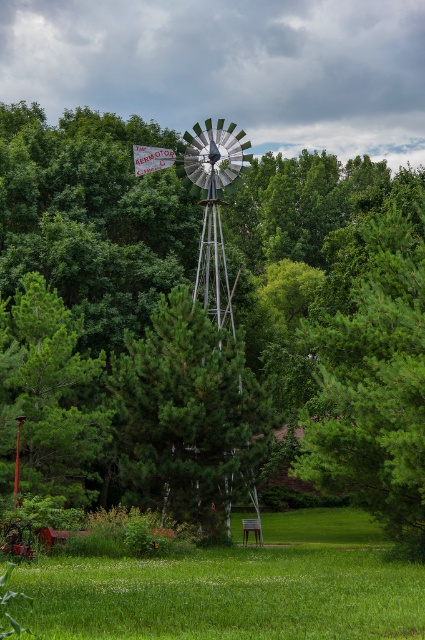
Question: Which of the following is the farthest from the observer?

Choices:
 (A) green grass at lower center
 (B) green textured pine tree at center

Answer: (B)

Question: Estimate the real-world distances between objects in this image. Which object is closer to the green textured pine tree at center?

Choices:
 (A) green matte tree at center
 (B) green leafy tree at center
 (C) green grass at lower center

Answer: (C)

Question: Which of the following is the closest to the observer?

Choices:
 (A) (334, 355)
 (B) (357, 493)

Answer: (B)

Question: Does green grass at lower center appear under green textured pine tree at center?

Choices:
 (A) no
 (B) yes

Answer: (B)

Question: Does green leafy tree at center appear on the left side of green grass at lower center?

Choices:
 (A) no
 (B) yes

Answer: (B)

Question: Is green leafy tree at center below green matte tree at center?

Choices:
 (A) no
 (B) yes

Answer: (A)